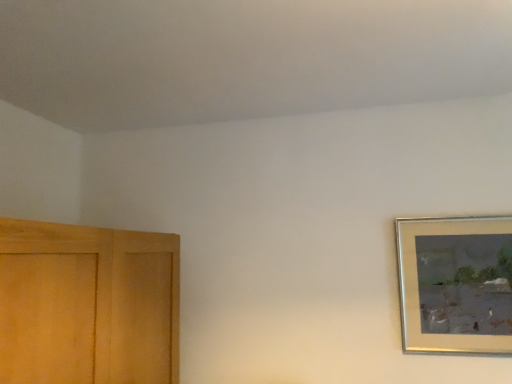
You are a GUI agent. You are given a task and a screenshot of the screen. Output one action in this format:
    pyautogui.click(x=<x>, y=<y>)
    Task: Click on the silver metallic picture frame at upper right
    
    Given the screenshot: What is the action you would take?
    pyautogui.click(x=456, y=284)

Image resolution: width=512 pixels, height=384 pixels. What do you see at coordinates (456, 284) in the screenshot?
I see `silver metallic picture frame at upper right` at bounding box center [456, 284].

What are the coordinates of `silver metallic picture frame at upper right` in the screenshot? It's located at [456, 284].